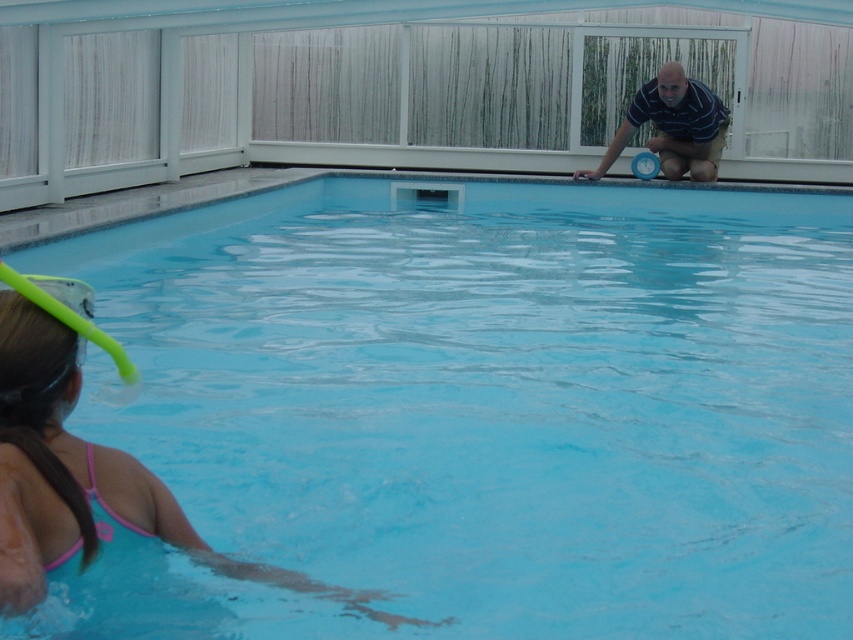
Question: Is transparent glass swimming pool at center closer to camera compared to pink fabric swimwear at lower left?

Choices:
 (A) no
 (B) yes

Answer: (A)

Question: Can you confirm if pink fabric swimwear at lower left is positioned to the left of striped cotton shirt at upper right?

Choices:
 (A) no
 (B) yes

Answer: (B)

Question: Where is transparent glass swimming pool at center located in relation to pink fabric swimwear at lower left in the image?

Choices:
 (A) right
 (B) left

Answer: (A)

Question: Which point is farther to the camera?

Choices:
 (A) pink fabric swimwear at lower left
 (B) transparent glass swimming pool at center
 (C) striped cotton shirt at upper right

Answer: (C)

Question: Among these points, which one is farthest from the camera?

Choices:
 (A) (448, 515)
 (B) (138, 525)
 (C) (699, 93)

Answer: (C)

Question: Which is farther from the transparent glass swimming pool at center?

Choices:
 (A) pink fabric swimwear at lower left
 (B) striped cotton shirt at upper right

Answer: (B)